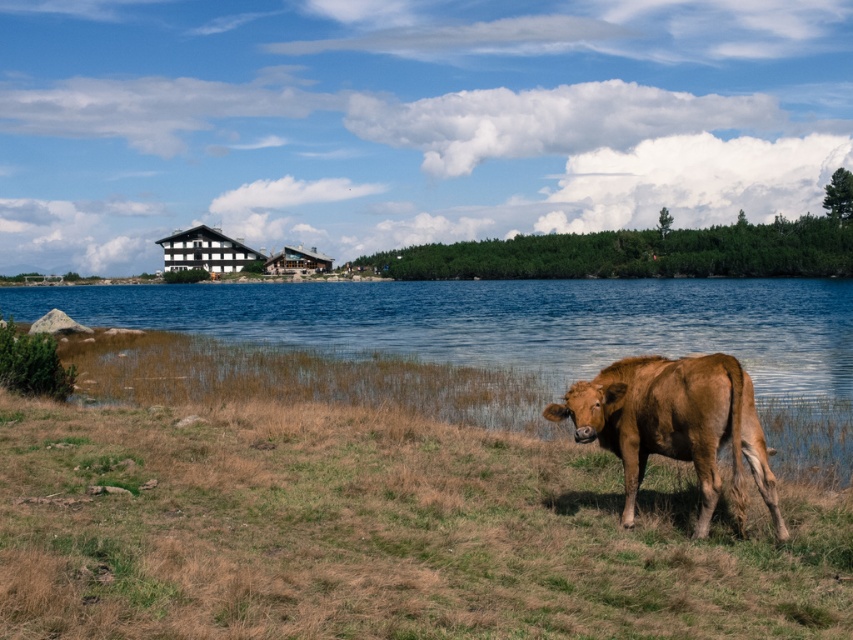
Question: Can you confirm if brown grassy at lower right is positioned to the left of brown glossy bull at lower right?

Choices:
 (A) no
 (B) yes

Answer: (B)

Question: From the image, what is the correct spatial relationship of brown grassy at lower right in relation to brown glossy bull at lower right?

Choices:
 (A) below
 (B) above

Answer: (A)

Question: Among these points, which one is nearest to the camera?

Choices:
 (A) (712, 365)
 (B) (55, 634)

Answer: (B)

Question: Is brown grassy at lower right closer to the viewer compared to brown glossy bull at lower right?

Choices:
 (A) yes
 (B) no

Answer: (A)